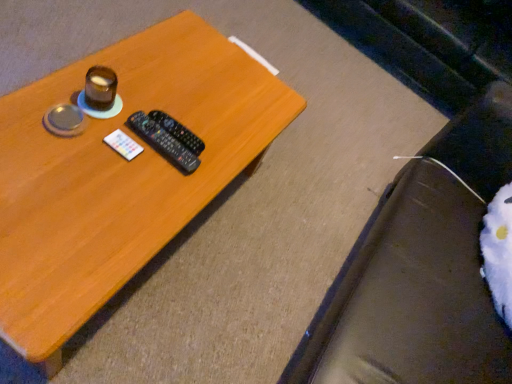
The image size is (512, 384). I want to click on free point above wooden table at center (from a real-world perspective), so click(x=113, y=150).